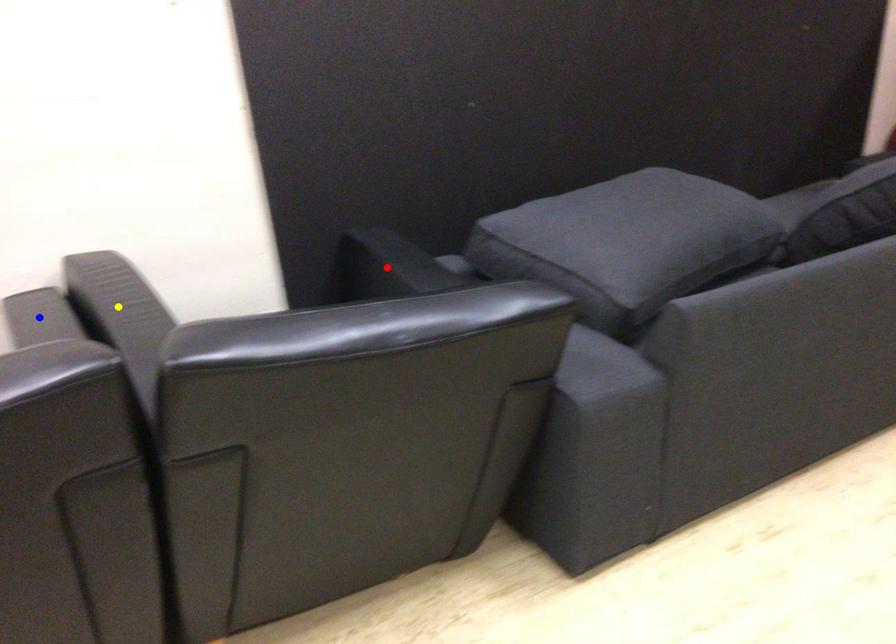
Order these from nearest to farthest:
red point | blue point | yellow point

blue point
yellow point
red point